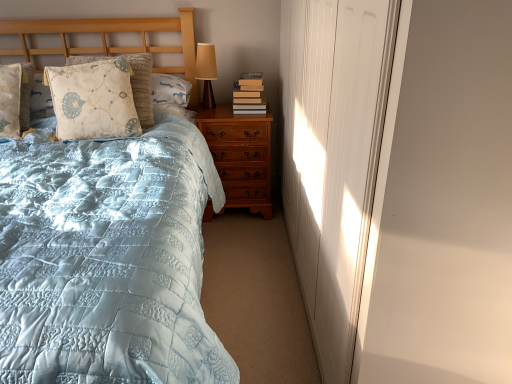
Question: From a real-world perspective, is matte brown table lamp at upper center physically below floral-patterned fabric pillow at upper left, which is the first pillow from right to left?

Choices:
 (A) yes
 (B) no

Answer: (B)

Question: Does matte brown table lamp at upper center have a greater height compared to floral-patterned fabric pillow at upper left, the second pillow from the left?

Choices:
 (A) no
 (B) yes

Answer: (A)

Question: Would you say matte brown table lamp at upper center is outside floral-patterned fabric pillow at upper left, which is the first pillow from right to left?

Choices:
 (A) no
 (B) yes

Answer: (B)

Question: Considering the relative sizes of matte brown table lamp at upper center and floral-patterned fabric pillow at upper left, which is the first pillow from right to left, in the image provided, is matte brown table lamp at upper center shorter than floral-patterned fabric pillow at upper left, which is the first pillow from right to left,?

Choices:
 (A) no
 (B) yes

Answer: (B)

Question: Are matte brown table lamp at upper center and floral-patterned fabric pillow at upper left, the second pillow from the left, located far from each other?

Choices:
 (A) yes
 (B) no

Answer: (B)

Question: Does matte brown table lamp at upper center lie behind floral-patterned fabric pillow at upper left, which is the first pillow from right to left?

Choices:
 (A) no
 (B) yes

Answer: (B)

Question: Is hardcover books at right to the left of light blue quilted bed at left from the viewer's perspective?

Choices:
 (A) no
 (B) yes

Answer: (A)

Question: Is hardcover books at right bigger than light blue quilted bed at left?

Choices:
 (A) no
 (B) yes

Answer: (A)

Question: From the image's perspective, is hardcover books at right on top of light blue quilted bed at left?

Choices:
 (A) no
 (B) yes

Answer: (B)

Question: Does hardcover books at right come behind light blue quilted bed at left?

Choices:
 (A) yes
 (B) no

Answer: (A)

Question: Considering the relative sizes of hardcover books at right and light blue quilted bed at left in the image provided, is hardcover books at right smaller than light blue quilted bed at left?

Choices:
 (A) yes
 (B) no

Answer: (A)

Question: Does hardcover books at right have a lesser height compared to light blue quilted bed at left?

Choices:
 (A) no
 (B) yes

Answer: (B)

Question: Does floral-patterned fabric pillow at upper left, the second pillow from the left, have a lesser width compared to light blue quilted bed at left?

Choices:
 (A) yes
 (B) no

Answer: (A)